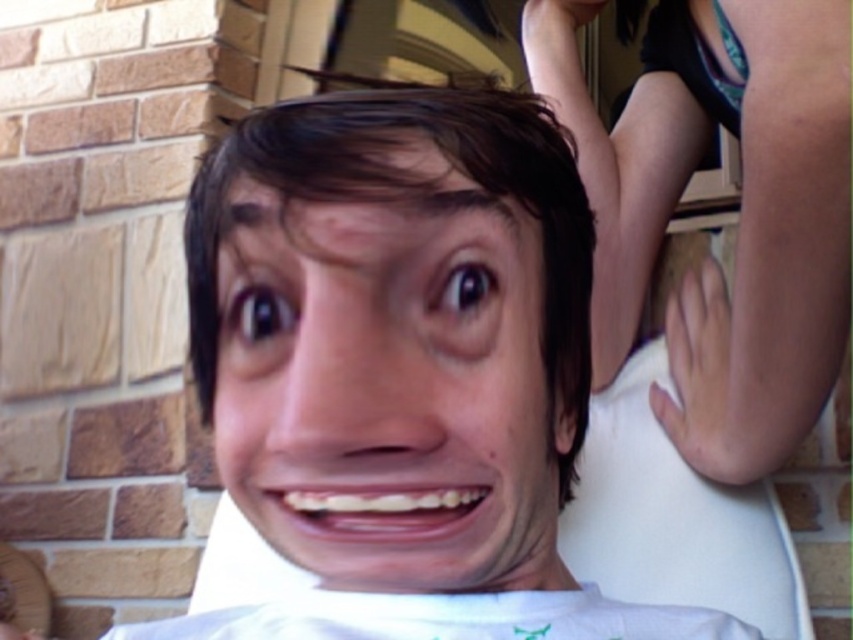
You are a fashion designer analyzing this image. You need to determine if the white matte shirt at center can be worn with a hair accessory that requires the shirt to be wider than the brown matte hair at center. Based on the image, is this possible?

The white matte shirt at center has a width larger than the brown matte hair at center, so yes, the shirt can be worn with the accessory as it meets the width requirement.

You are a photographer adjusting your camera settings to focus on the white matte shirt at center. What are the coordinates where you should aim your focus point?

The coordinates to focus on the white matte shirt at center are at point (402, 365).

You are a photographer adjusting your camera settings to focus on the subject in the image. You notice the white matte shirt at center and the brown matte hair at center. Which object should you adjust your focus to first if you want to ensure the subject closest to the camera is sharp?

The white matte shirt at center is to the left of brown matte hair at center, so you should focus on the white matte shirt at center first since it is closer to the camera.